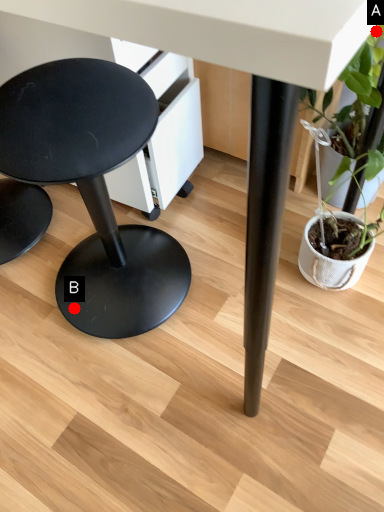
Question: Two points are circled on the image, labeled by A and B beside each circle. Which point is closer to the camera?

Choices:
 (A) A is closer
 (B) B is closer

Answer: (A)